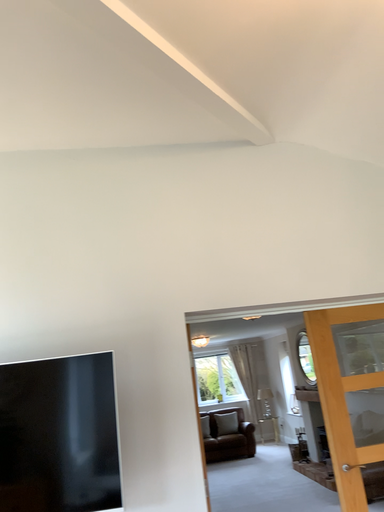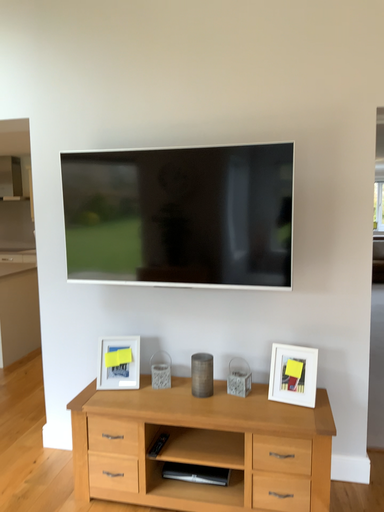
Question: How did the camera likely rotate when shooting the video?

Choices:
 (A) rotated upward
 (B) rotated downward

Answer: (B)